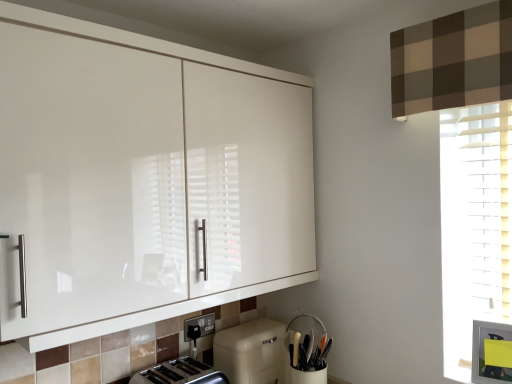
Question: Should I look upward or downward to see silver metallic toaster at lower center?

Choices:
 (A) down
 (B) up

Answer: (A)

Question: Considering the relative sizes of white glossy cabinet at upper left and white matte utensil holder at lower center in the image provided, is white glossy cabinet at upper left wider than white matte utensil holder at lower center?

Choices:
 (A) no
 (B) yes

Answer: (B)

Question: Can white matte utensil holder at lower center be found inside white glossy cabinet at upper left?

Choices:
 (A) no
 (B) yes

Answer: (A)

Question: Is white glossy cabinet at upper left outside white matte utensil holder at lower center?

Choices:
 (A) yes
 (B) no

Answer: (A)

Question: Is white glossy cabinet at upper left positioned in front of white matte utensil holder at lower center?

Choices:
 (A) no
 (B) yes

Answer: (B)

Question: Is white glossy cabinet at upper left not close to white matte utensil holder at lower center?

Choices:
 (A) yes
 (B) no

Answer: (B)

Question: Can you confirm if white glossy cabinet at upper left is shorter than white matte utensil holder at lower center?

Choices:
 (A) no
 (B) yes

Answer: (A)

Question: From a real-world perspective, is white glossy cabinet at upper left positioned under beige matte dishwasher at lower center based on gravity?

Choices:
 (A) no
 (B) yes

Answer: (A)

Question: Is white glossy cabinet at upper left not close to beige matte dishwasher at lower center?

Choices:
 (A) no
 (B) yes

Answer: (A)

Question: Is beige matte dishwasher at lower center at the back of white glossy cabinet at upper left?

Choices:
 (A) no
 (B) yes

Answer: (A)

Question: Is white glossy cabinet at upper left shorter than beige matte dishwasher at lower center?

Choices:
 (A) yes
 (B) no

Answer: (B)

Question: Is white glossy cabinet at upper left wider than beige matte dishwasher at lower center?

Choices:
 (A) yes
 (B) no

Answer: (A)

Question: Does white glossy cabinet at upper left appear on the left side of beige matte dishwasher at lower center?

Choices:
 (A) yes
 (B) no

Answer: (A)

Question: Is the depth of beige matte dishwasher at lower center greater than that of black plastic electric outlet at lower center?

Choices:
 (A) yes
 (B) no

Answer: (B)